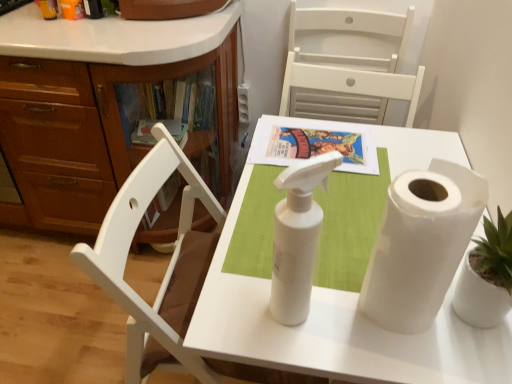
Where is `vacant region to the left of white paper at right`? vacant region to the left of white paper at right is located at coordinates (312, 294).